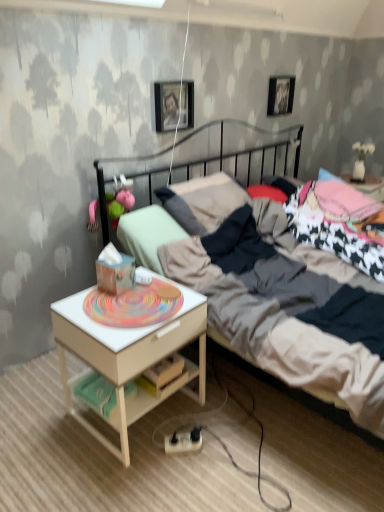
Question: Does metallic photo frame at upper center, which is the 2th picture frame from back to front, contain metallic silver picture frame at upper center, the 1th picture frame from the top?

Choices:
 (A) yes
 (B) no

Answer: (B)

Question: Is metallic photo frame at upper center, which is the 2th picture frame from back to front, positioned with its back to metallic silver picture frame at upper center, the 1th picture frame from the top?

Choices:
 (A) yes
 (B) no

Answer: (B)

Question: Is metallic photo frame at upper center, which is counted as the second picture frame, starting from the right, next to metallic silver picture frame at upper center, which is the 2th picture frame in front-to-back order, and touching it?

Choices:
 (A) no
 (B) yes

Answer: (A)

Question: Could you tell me if metallic photo frame at upper center, the first picture frame in the bottom-to-top sequence, is turned towards metallic silver picture frame at upper center, the 1th picture frame from the top?

Choices:
 (A) yes
 (B) no

Answer: (B)

Question: Considering the relative sizes of metallic photo frame at upper center, which is the 2th picture frame from back to front, and metallic silver picture frame at upper center, arranged as the first picture frame when viewed from the right, in the image provided, is metallic photo frame at upper center, which is the 2th picture frame from back to front, bigger than metallic silver picture frame at upper center, arranged as the first picture frame when viewed from the right,?

Choices:
 (A) yes
 (B) no

Answer: (A)

Question: Does point (x=132, y=316) appear closer or farther from the camera than point (x=286, y=94)?

Choices:
 (A) farther
 (B) closer

Answer: (B)

Question: From a real-world perspective, relative to metallic silver picture frame at upper center, which is the 2th picture frame in front-to-back order, is white wood nightstand at lower left vertically above or below?

Choices:
 (A) above
 (B) below

Answer: (B)

Question: Considering the positions of white wood nightstand at lower left and metallic silver picture frame at upper center, which appears as the first picture frame when viewed from the back, in the image, is white wood nightstand at lower left bigger or smaller than metallic silver picture frame at upper center, which appears as the first picture frame when viewed from the back,?

Choices:
 (A) big
 (B) small

Answer: (A)

Question: Is white wood nightstand at lower left taller or shorter than metallic silver picture frame at upper center, arranged as the first picture frame when viewed from the right?

Choices:
 (A) tall
 (B) short

Answer: (A)

Question: Considering the positions of point (269, 87) and point (61, 354), is point (269, 87) closer or farther from the camera than point (61, 354)?

Choices:
 (A) closer
 (B) farther

Answer: (B)

Question: In the image, is metallic silver picture frame at upper center, which is the second picture frame in left-to-right order, positioned in front of or behind white wood nightstand at lower left?

Choices:
 (A) front
 (B) behind

Answer: (B)

Question: Considering the relative positions of metallic silver picture frame at upper center, which is the second picture frame in left-to-right order, and white wood nightstand at lower left in the image provided, is metallic silver picture frame at upper center, which is the second picture frame in left-to-right order, to the left or to the right of white wood nightstand at lower left?

Choices:
 (A) right
 (B) left

Answer: (A)

Question: In terms of size, does metallic silver picture frame at upper center, the 1th picture frame from the top, appear bigger or smaller than white wood nightstand at lower left?

Choices:
 (A) big
 (B) small

Answer: (B)

Question: Considering the positions of point (170, 111) and point (144, 304), is point (170, 111) closer or farther from the camera than point (144, 304)?

Choices:
 (A) farther
 (B) closer

Answer: (A)

Question: Is metallic photo frame at upper center, the first picture frame from the left, wider or thinner than white wood nightstand at lower left?

Choices:
 (A) wide
 (B) thin

Answer: (B)